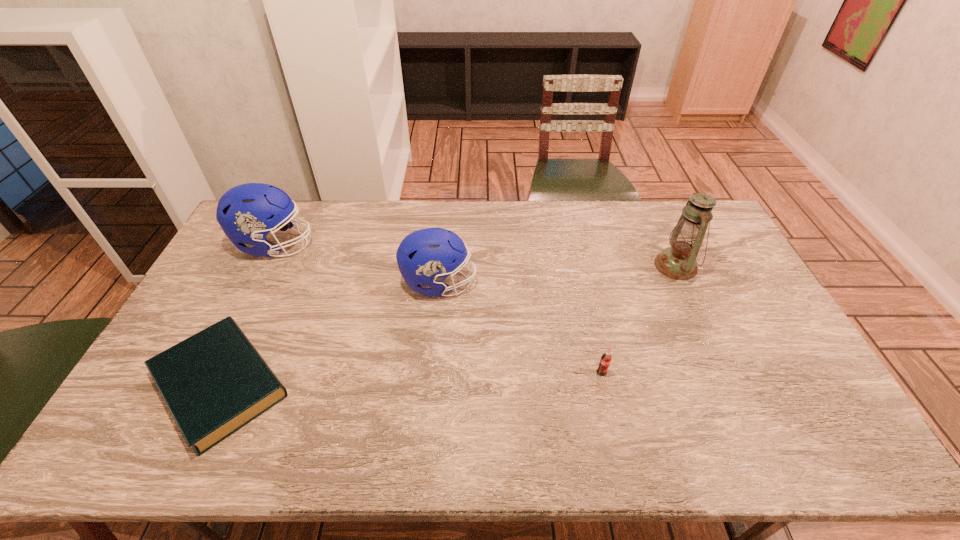
Where is `unoccupied position between the right football helmet and the book`? The width and height of the screenshot is (960, 540). unoccupied position between the right football helmet and the book is located at coordinates (329, 334).

At what (x,y) coordinates should I click in order to perform the action: click on vacant area between the oil lamp and the left football helmet. Please return your answer as a coordinate pair (x, y). The height and width of the screenshot is (540, 960). Looking at the image, I should click on (475, 255).

Locate an element on the screen. The image size is (960, 540). vacant area that lies between the soda bottle and the shortest object is located at coordinates (411, 379).

Identify the location of empty space that is in between the shortest object and the rightmost object. The image size is (960, 540). (448, 325).

Find the location of `vacant point located between the third object from right to left and the left football helmet`. vacant point located between the third object from right to left and the left football helmet is located at coordinates (357, 264).

Identify the location of object that is the nearest to the left football helmet. (215, 382).

Image resolution: width=960 pixels, height=540 pixels. What are the coordinates of `object that ranks as the fourth closest to the shortest object` in the screenshot? It's located at (678, 262).

Identify the location of free space that satisfies the following two spatial constraints: 1. on the face guard of the rightmost object; 2. on the right side of the left football helmet. The image size is (960, 540). (265, 266).

Where is `free point that satisfies the following two spatial constraints: 1. on the face guard of the book; 2. on the left side of the left football helmet`? free point that satisfies the following two spatial constraints: 1. on the face guard of the book; 2. on the left side of the left football helmet is located at coordinates (205, 384).

Locate an element on the screen. free space that satisfies the following two spatial constraints: 1. on the back side of the oil lamp; 2. on the face guard of the left football helmet is located at coordinates (666, 245).